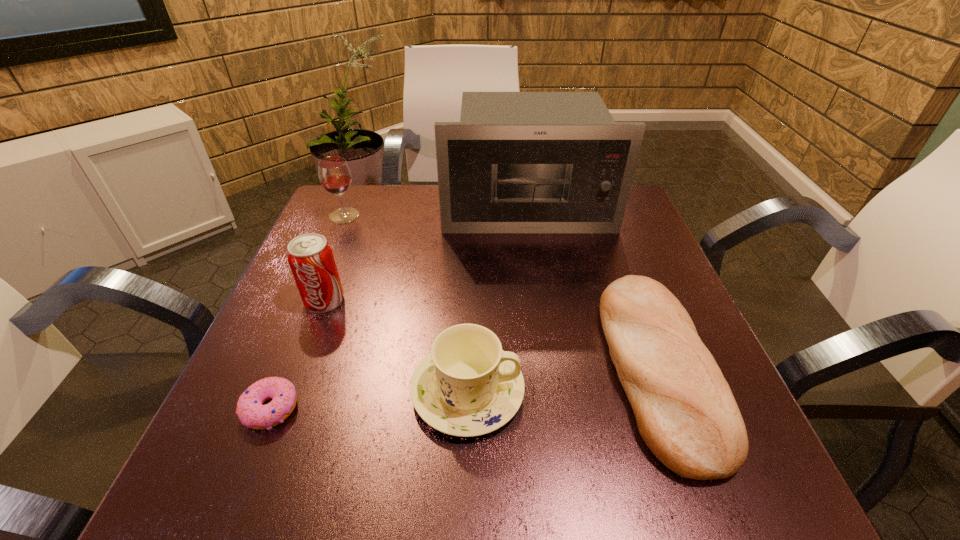
You are a GUI agent. You are given a task and a screenshot of the screen. Output one action in this format:
    pyautogui.click(x=<x>, y=<y>)
    Task: Click on the vacant space that satisfies the following two spatial constraints: 1. on the back side of the soda can; 2. on the left side of the doughnut
    This screenshot has height=540, width=960.
    Given the screenshot: What is the action you would take?
    pyautogui.click(x=314, y=301)